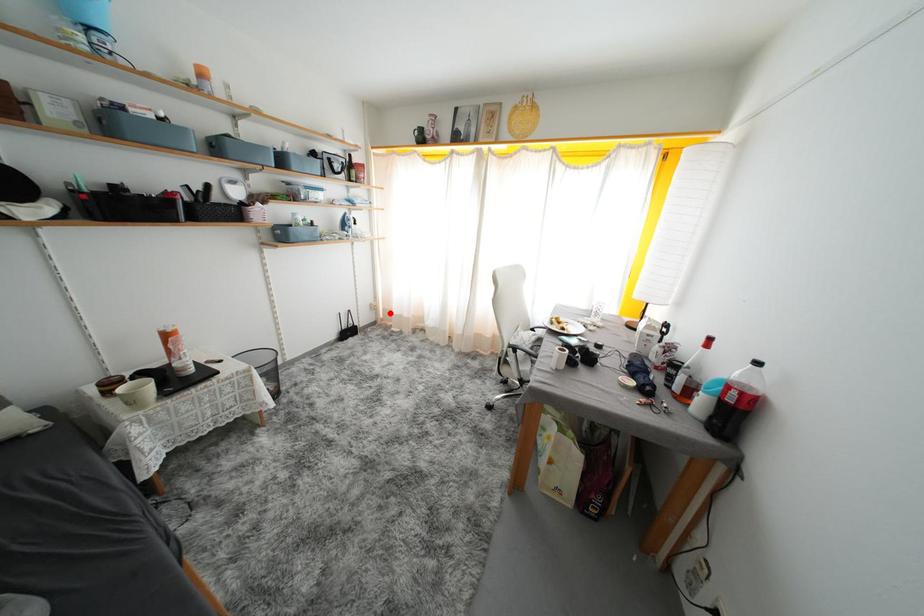
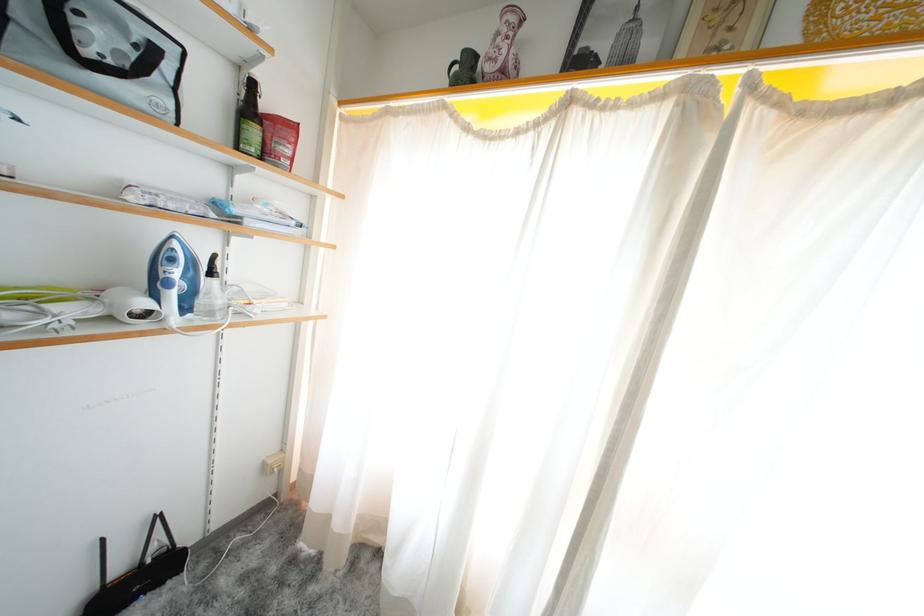
Locate, in the second image, the point that corresponds to the highlighted location in the first image.

(306, 475)